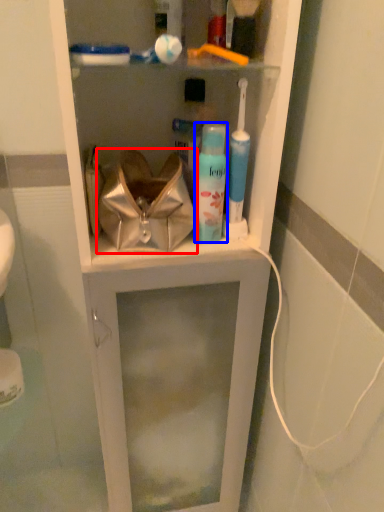
Question: Which object appears farthest to the camera in this image, handbag (highlighted by a red box) or toiletry (highlighted by a blue box)?

Choices:
 (A) handbag
 (B) toiletry

Answer: (B)